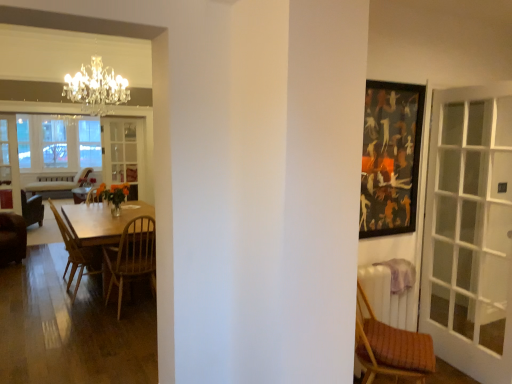
Question: Is wooden at left, which appears as the 2th chair when viewed from the right, closer to the viewer compared to brown leather chair at left, acting as the first chair starting from the left?

Choices:
 (A) no
 (B) yes

Answer: (B)

Question: From a real-world perspective, is wooden at left, which ranks as the second chair in front-to-back order, on brown leather chair at left, acting as the 4th chair starting from the right?

Choices:
 (A) no
 (B) yes

Answer: (B)

Question: Is wooden at left, which is counted as the third chair, starting from the left, shorter than brown leather chair at left, which is the fourth chair in front-to-back order?

Choices:
 (A) no
 (B) yes

Answer: (A)

Question: Is wooden at left, which is counted as the third chair, starting from the left, beside brown leather chair at left, acting as the 4th chair starting from the right?

Choices:
 (A) yes
 (B) no

Answer: (B)

Question: Does wooden at left, which is counted as the third chair, starting from the left, have a greater height compared to brown leather chair at left, which is the fourth chair in front-to-back order?

Choices:
 (A) no
 (B) yes

Answer: (B)

Question: Is wooden at left, which is the third chair from back to front, smaller than brown leather chair at left, acting as the first chair starting from the left?

Choices:
 (A) no
 (B) yes

Answer: (A)

Question: Can you confirm if wooden textured chair at right, the fourth chair when ordered from back to front, is taller than clear glass screen door at center, placed as the 1th screen door when sorted from right to left?

Choices:
 (A) yes
 (B) no

Answer: (B)

Question: Is wooden textured chair at right, the first chair from the front, surrounding clear glass screen door at center, the second screen door from the left?

Choices:
 (A) no
 (B) yes

Answer: (A)

Question: Is wooden textured chair at right, the first chair from the front, aimed at clear glass screen door at center, the second screen door from the left?

Choices:
 (A) yes
 (B) no

Answer: (B)

Question: Is wooden textured chair at right, the fourth chair when ordered from back to front, further to the viewer compared to clear glass screen door at center, acting as the first screen door starting from the back?

Choices:
 (A) no
 (B) yes

Answer: (A)

Question: Is wooden textured chair at right, acting as the 4th chair starting from the left, in contact with clear glass screen door at center, the second screen door from the left?

Choices:
 (A) no
 (B) yes

Answer: (A)

Question: Is wooden textured chair at right, the 1th chair positioned from the right, far away from clear glass screen door at center, placed as the 1th screen door when sorted from right to left?

Choices:
 (A) no
 (B) yes

Answer: (B)

Question: Is clear glass screen door at center, the second screen door from the left, wider than wooden at left, which is counted as the third chair, starting from the left?

Choices:
 (A) yes
 (B) no

Answer: (B)